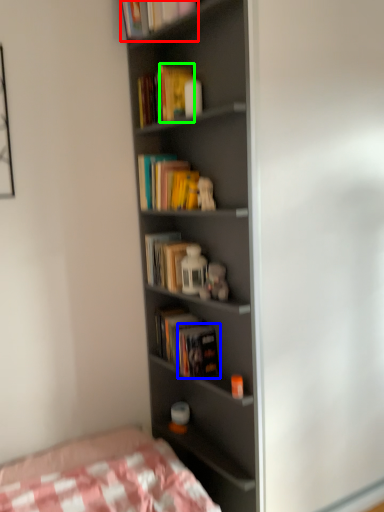
Question: Which is farther away from book (highlighted by a red box)? paperback book (highlighted by a blue box) or paperback book (highlighted by a green box)?

Choices:
 (A) paperback book
 (B) paperback book

Answer: (A)